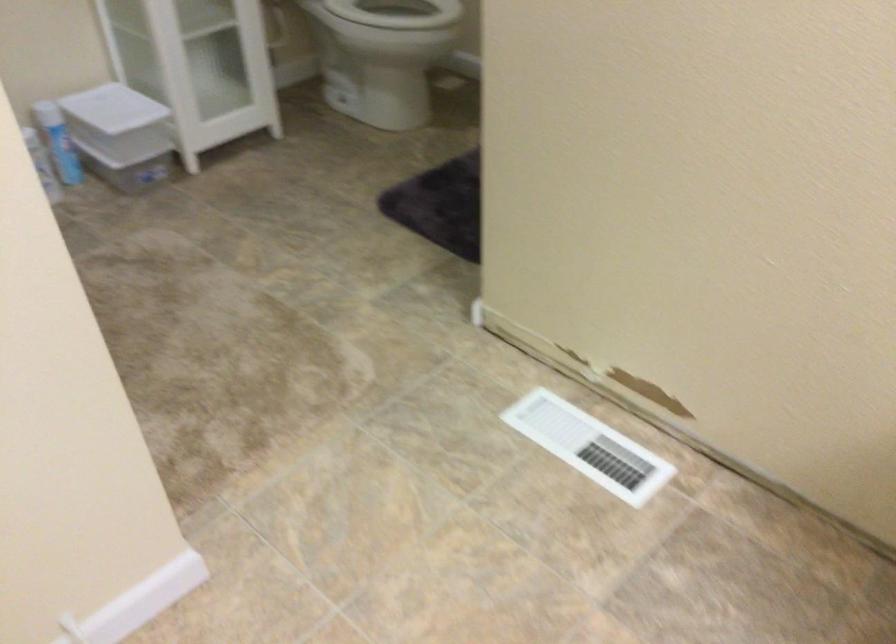
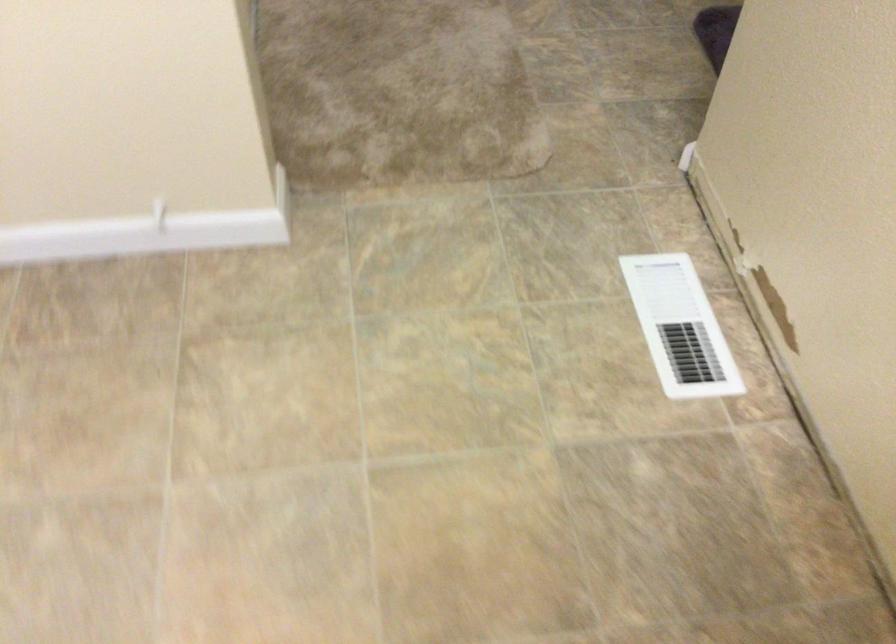
Find the pixel in the second image that matches (589,448) in the first image.

(679, 327)